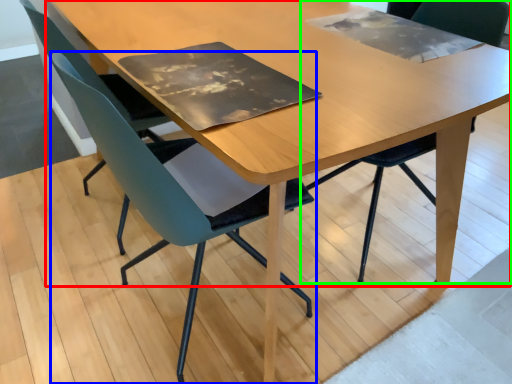
Question: Considering the real-world distances, which object is farthest from table (highlighted by a red box)? chair (highlighted by a blue box) or chair (highlighted by a green box)?

Choices:
 (A) chair
 (B) chair

Answer: (B)